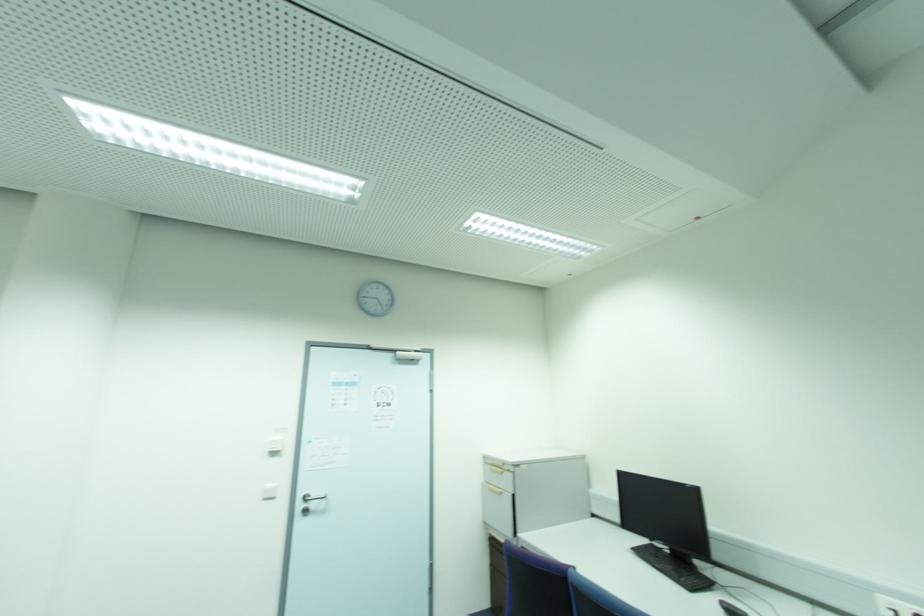
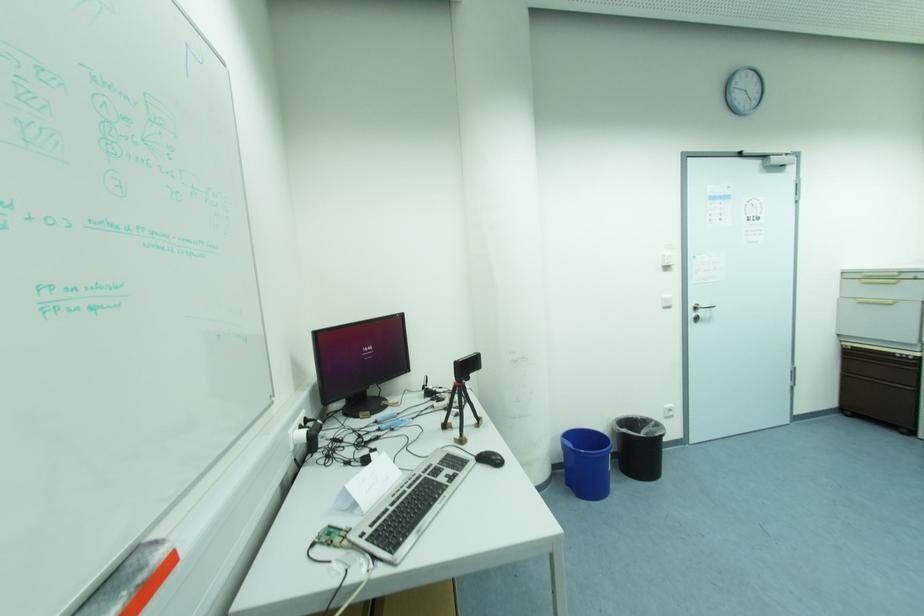
Locate, in the second image, the point that corresponds to the point at 277,438 in the first image.

(669, 254)